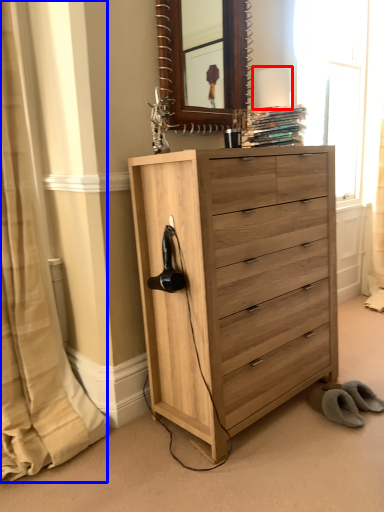
Question: Which object appears farthest to the camera in this image, table lamp (highlighted by a red box) or curtain (highlighted by a blue box)?

Choices:
 (A) table lamp
 (B) curtain

Answer: (A)